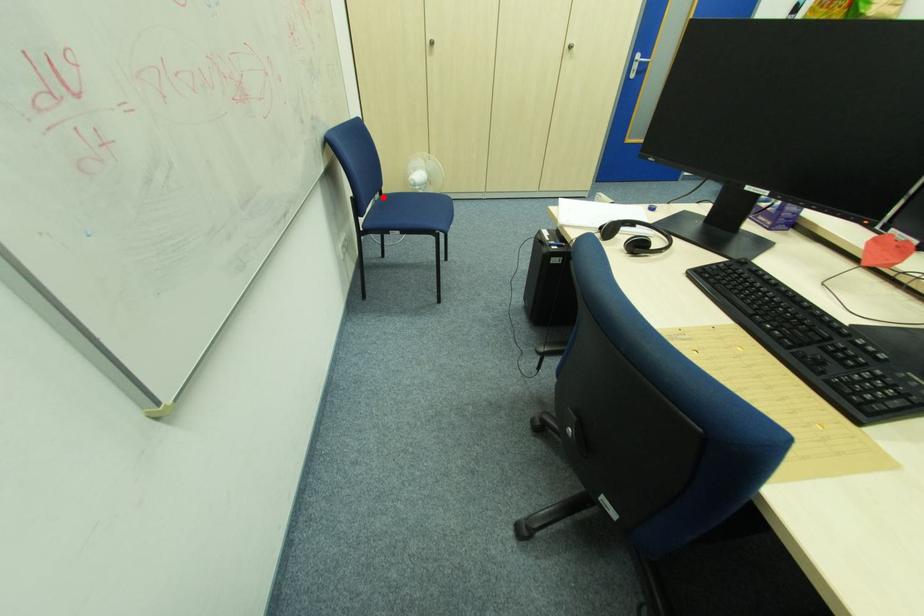
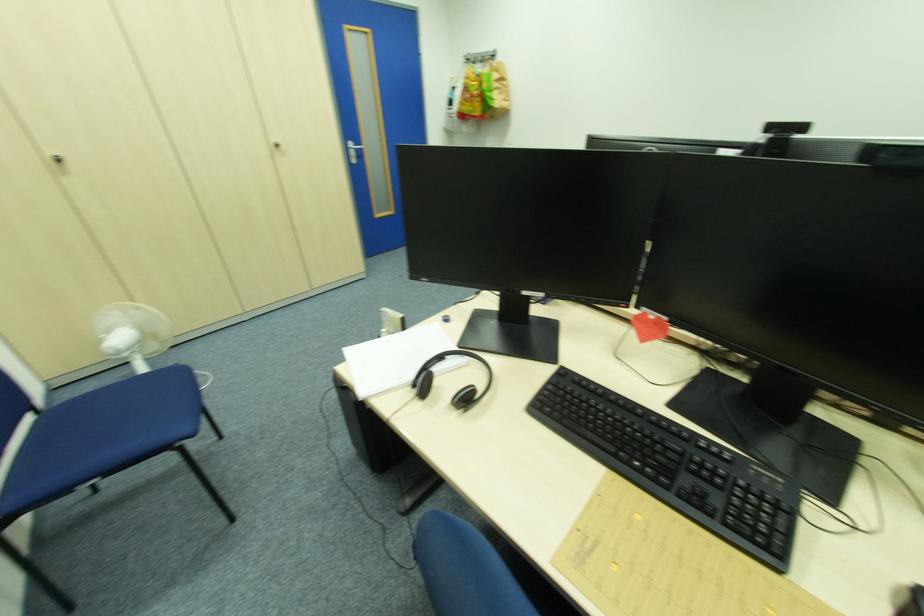
In the second image, find the point that corresponds to the highlighted location in the first image.

(38, 421)